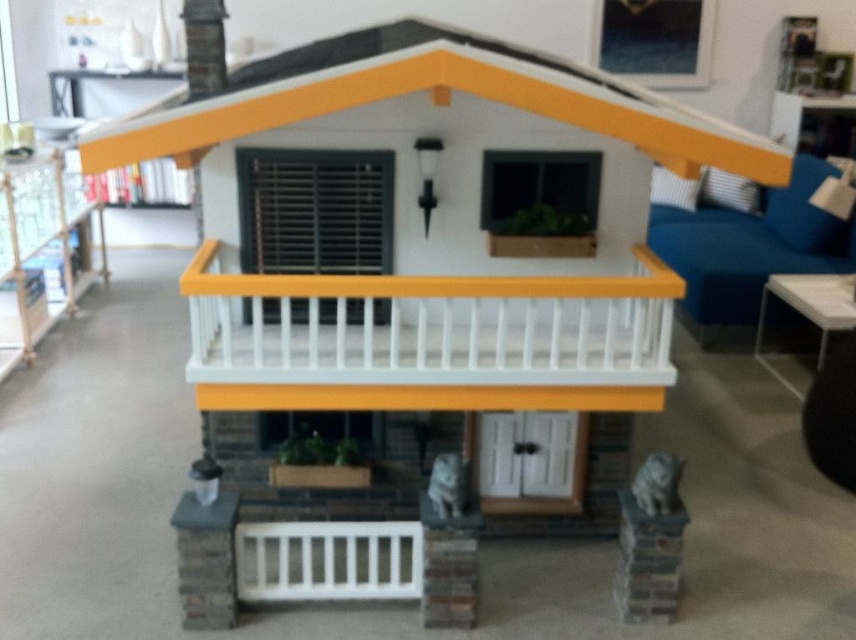
Between point (670, 273) and point (372, 561), which one is positioned behind?

The point (670, 273) is more distant.

Is white painted wood balustrade at center above white painted wood balustrade at lower center?

Yes, white painted wood balustrade at center is above white painted wood balustrade at lower center.

The height and width of the screenshot is (640, 856). Describe the element at coordinates (438, 342) in the screenshot. I see `white painted wood balustrade at center` at that location.

This screenshot has height=640, width=856. Identify the location of white painted wood balustrade at center. (438, 342).

Can you confirm if white painted wood balustrade at center is smaller than metallic silver bookshelf at left?

Yes, white painted wood balustrade at center is smaller than metallic silver bookshelf at left.

Can you confirm if white painted wood balustrade at center is bigger than metallic silver bookshelf at left?

Incorrect, white painted wood balustrade at center is not larger than metallic silver bookshelf at left.

Locate an element on the screen. This screenshot has width=856, height=640. white painted wood balustrade at center is located at coordinates (438, 342).

Who is more distant from viewer, (x=70, y=282) or (x=367, y=589)?

A: The point (x=70, y=282) is more distant.

Is metallic silver bookshelf at left shorter than white painted wood balustrade at lower center?

No, metallic silver bookshelf at left is not shorter than white painted wood balustrade at lower center.

Who is more forward, (64, 177) or (339, 596)?

Point (339, 596) is in front.

The width and height of the screenshot is (856, 640). I want to click on metallic silver bookshelf at left, so click(x=43, y=250).